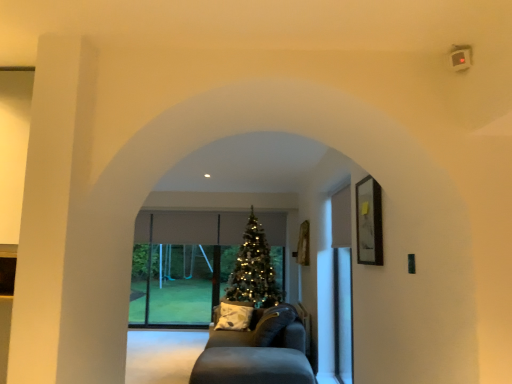
Question: Does shiny gold christmas tree at center have a larger size compared to dark gray fabric couch at center?

Choices:
 (A) no
 (B) yes

Answer: (B)

Question: Could dark gray fabric couch at center be considered to be inside shiny gold christmas tree at center?

Choices:
 (A) yes
 (B) no

Answer: (B)

Question: From the image's perspective, is shiny gold christmas tree at center below dark gray fabric couch at center?

Choices:
 (A) yes
 (B) no

Answer: (B)

Question: From a real-world perspective, does shiny gold christmas tree at center sit lower than dark gray fabric couch at center?

Choices:
 (A) yes
 (B) no

Answer: (B)

Question: Considering the relative positions of shiny gold christmas tree at center and dark gray fabric couch at center in the image provided, is shiny gold christmas tree at center to the left of dark gray fabric couch at center from the viewer's perspective?

Choices:
 (A) yes
 (B) no

Answer: (A)

Question: Considering their positions, is transparent glass door at center located in front of or behind dark gray fabric couch at center?

Choices:
 (A) behind
 (B) front

Answer: (A)

Question: Based on their positions, is transparent glass door at center located to the left or right of dark gray fabric couch at center?

Choices:
 (A) left
 (B) right

Answer: (A)

Question: In terms of width, does transparent glass door at center look wider or thinner when compared to dark gray fabric couch at center?

Choices:
 (A) thin
 (B) wide

Answer: (A)

Question: From a real-world perspective, is transparent glass door at center above or below dark gray fabric couch at center?

Choices:
 (A) above
 (B) below

Answer: (A)

Question: Looking at the image, does transparent glass door at center seem bigger or smaller compared to shiny gold christmas tree at center?

Choices:
 (A) small
 (B) big

Answer: (A)

Question: Which is correct: transparent glass door at center is inside shiny gold christmas tree at center, or outside of it?

Choices:
 (A) inside
 (B) outside

Answer: (B)

Question: From the image's perspective, relative to shiny gold christmas tree at center, is transparent glass door at center above or below?

Choices:
 (A) above
 (B) below

Answer: (B)

Question: In terms of height, does transparent glass door at center look taller or shorter compared to shiny gold christmas tree at center?

Choices:
 (A) short
 (B) tall

Answer: (A)

Question: From the image's perspective, is shiny gold christmas tree at center above or below transparent glass door at center?

Choices:
 (A) below
 (B) above

Answer: (B)

Question: Looking at their shapes, would you say shiny gold christmas tree at center is wider or thinner than transparent glass door at center?

Choices:
 (A) wide
 (B) thin

Answer: (A)